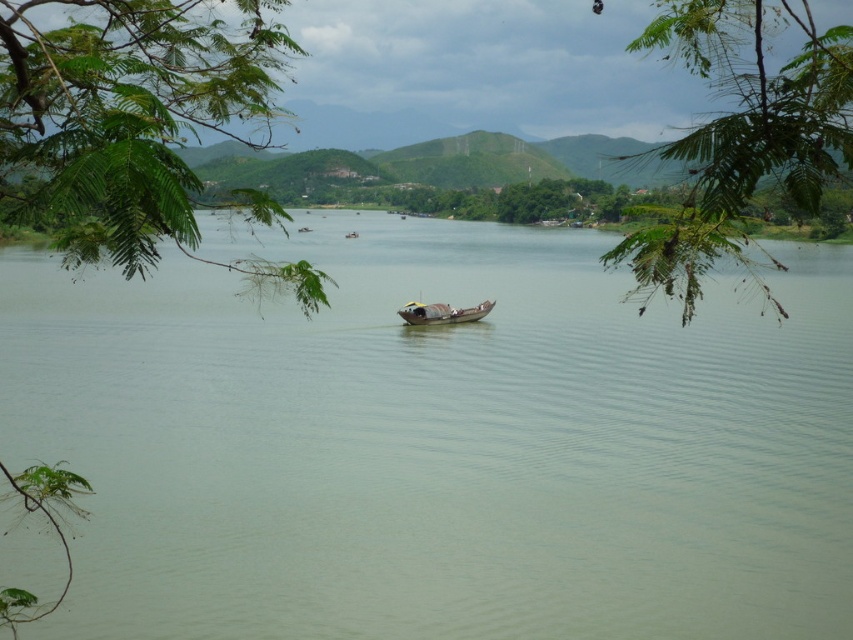
You are standing on the riverside and see the green leafy branch at upper left. If you want to reach it without getting into the water, which direction should you move towards?

The green leafy branch at upper left is in the upper left direction from your current position, so you should move towards the upper left direction to reach it without entering the water.

You are standing at the center of the boat in the middle of the river and want to point to the green leafy branch at upper center. In which general direction should you look?

The green leafy branch at upper center is located at point (x=741, y=134), which is in the upper center area of the image. Since you are on the boat in the middle of the river, you should look upwards and towards the center of the image to see the green leafy branch at upper center.

You are an observer looking at the riverscape. You notice the green leafy branch at upper left and the rusty metal boat at center. Which object is positioned higher in the image?

The green leafy branch at upper left is positioned higher in the image than the rusty metal boat at center.